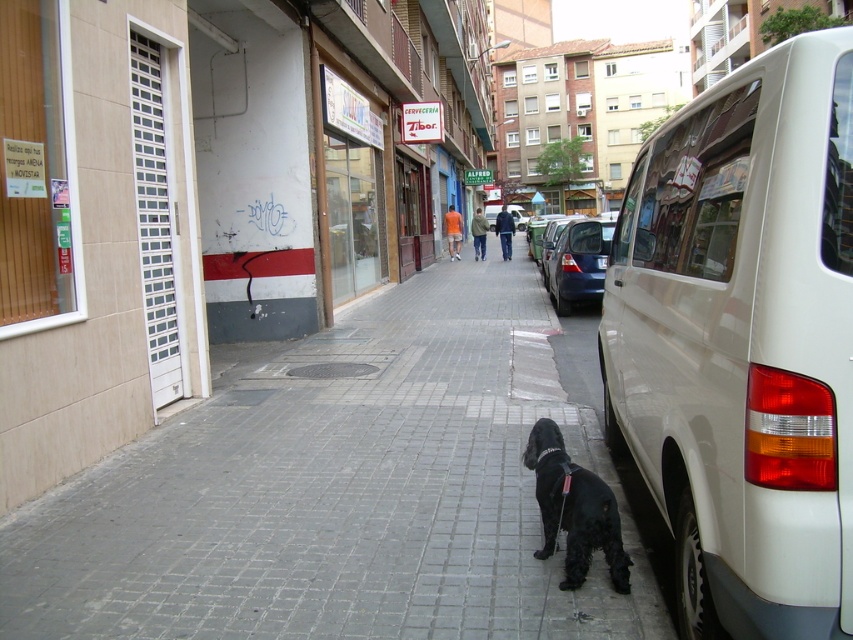
You are a delivery driver who needs to park your blue metallic car at center in a spot that requires the license plate to be visible. The parking rule states that the black plastic license plate at right must be at least 18 inches away from any obstacles. Based on the scene, can you park your car here?

The blue metallic car at center and the black plastic license plate at right are 16.62 inches apart. Since the required distance is 18 inches, the car cannot be parked here as it does not meet the parking rule requirement.

You are a delivery person trying to walk from the sidewalk to the beige building entrance. There is a gray brick pavement at center and a black plastic license plate at right in your path. Which object should you avoid stepping on to reach the entrance safely?

You should avoid stepping on the black plastic license plate at right because the gray brick pavement at center is closer to you, so the license plate is further away and not part of the path to the entrance.

You are a delivery person trying to navigate through the narrow street. You see the shiny black dog at center and the black plastic license plate at right. Which object is closer to you as you approach the scene?

The shiny black dog at center is closer to the viewer than the black plastic license plate at right, so the dog is closer to you as you approach the scene.